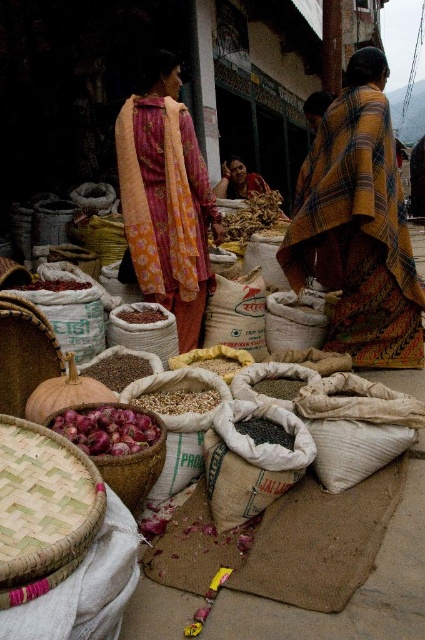
You are a customer at this market and want to pick up the dark red dried chilies at center. However, you notice the brown woven basket at lower left is blocking your path. Can you easily reach the chilies without moving the basket?

The brown woven basket at lower left is in front of the dark red dried chilies at center, so the basket is blocking the path to the chilies. You would need to move the basket to access them.

You are a customer at this market and want to buy the purple glossy onions at center and the red onion at center. Which one is closer to you?

The purple glossy onions at center is closer to you because it is in front of the red onion at center.

You are a customer at the market and want to buy onions. You see both the purple glossy onions at center and the red onion at center. Which one is directly above the other?

The purple glossy onions at center is positioned under the red onion at center, so the red onion at center is directly above the purple glossy onions at center.